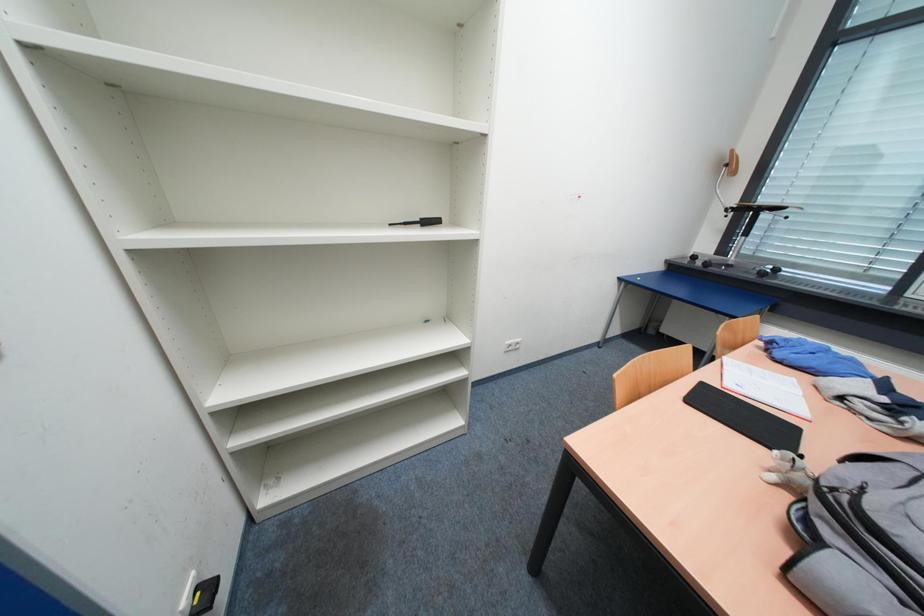
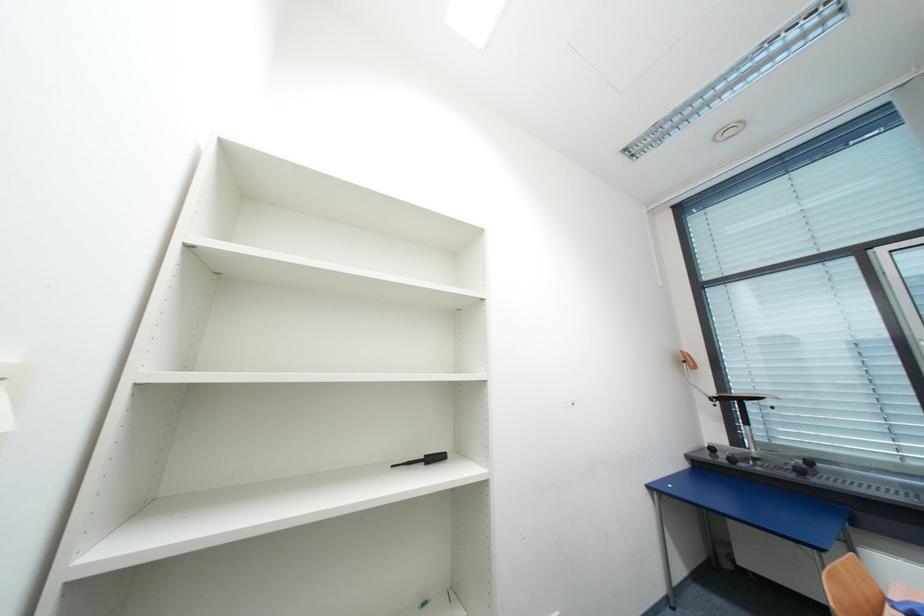
Question: The first image is from the beginning of the video and the second image is from the end. How did the camera likely rotate when shooting the video?

Choices:
 (A) Left
 (B) Right
 (C) Up
 (D) Down

Answer: (C)